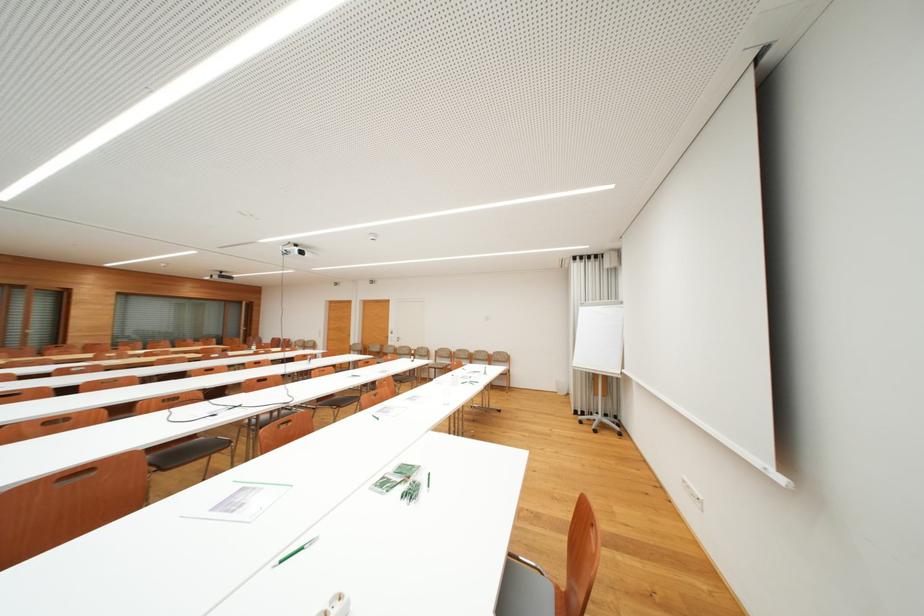
The width and height of the screenshot is (924, 616). I want to click on paper document, so click(x=237, y=501).